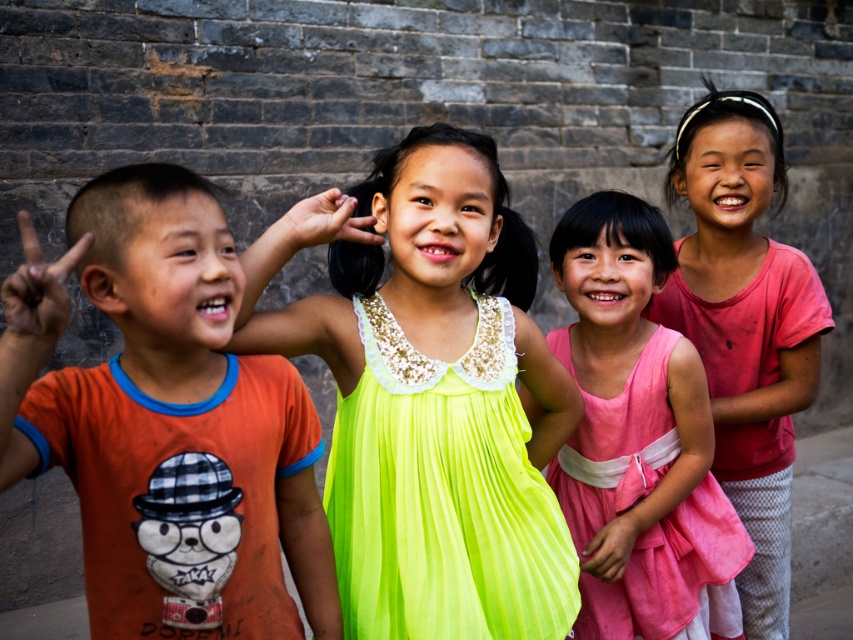
Question: Which object is positioned closest to the orange t-shirt at left?

Choices:
 (A) neon yellow fabric dress at center
 (B) pink cotton shirt at right

Answer: (A)

Question: Can you confirm if pink cotton shirt at right is positioned to the left of pink satin dress at center?

Choices:
 (A) no
 (B) yes

Answer: (A)

Question: Is neon yellow fabric dress at center smaller than pink cotton shirt at right?

Choices:
 (A) yes
 (B) no

Answer: (A)

Question: Does neon yellow fabric dress at center appear on the right side of pink satin dress at center?

Choices:
 (A) no
 (B) yes

Answer: (A)

Question: Among these points, which one is farthest from the camera?

Choices:
 (A) (169, 356)
 (B) (431, 602)

Answer: (B)

Question: Which of the following is the farthest from the observer?

Choices:
 (A) neon green chiffon dress at center
 (B) orange t-shirt at left

Answer: (A)